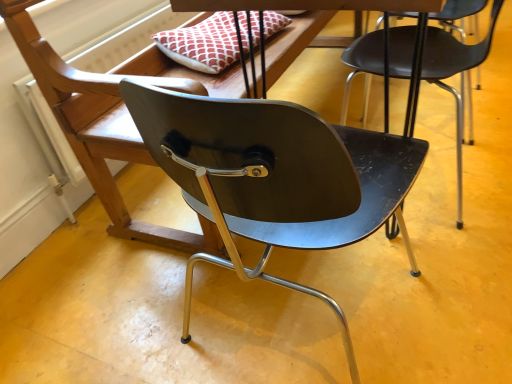
Find the location of a particular element. The width and height of the screenshot is (512, 384). vacant point to the right of matte black chair at center, which ranks as the first chair in right-to-left order is located at coordinates (494, 151).